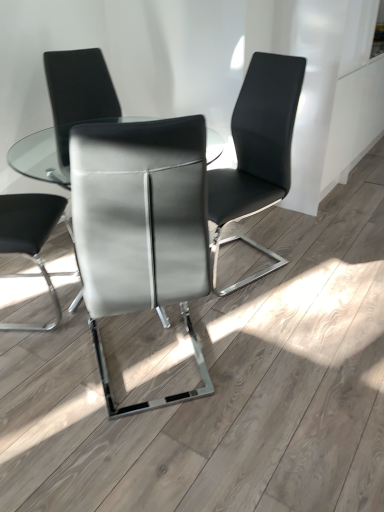
Identify the location of free space in front of clear glass table at center. (152, 411).